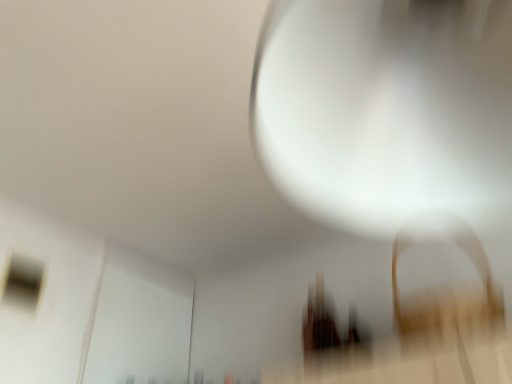
Question: From a real-world perspective, is matte glass window at upper left positioned under white glossy light bulb at upper center based on gravity?

Choices:
 (A) yes
 (B) no

Answer: (B)

Question: Is matte glass window at upper left located outside white glossy light bulb at upper center?

Choices:
 (A) no
 (B) yes

Answer: (B)

Question: Is matte glass window at upper left far away from white glossy light bulb at upper center?

Choices:
 (A) no
 (B) yes

Answer: (B)

Question: From a real-world perspective, is matte glass window at upper left over white glossy light bulb at upper center?

Choices:
 (A) no
 (B) yes

Answer: (B)

Question: Can you confirm if matte glass window at upper left is shorter than white glossy light bulb at upper center?

Choices:
 (A) no
 (B) yes

Answer: (B)

Question: Is matte glass window at upper left taller than white glossy light bulb at upper center?

Choices:
 (A) yes
 (B) no

Answer: (B)

Question: Could matte glass window at upper left be considered to be inside white glossy light bulb at upper center?

Choices:
 (A) yes
 (B) no

Answer: (B)

Question: From the image's perspective, is white glossy light bulb at upper center over matte glass window at upper left?

Choices:
 (A) no
 (B) yes

Answer: (B)

Question: From a real-world perspective, is white glossy light bulb at upper center below matte glass window at upper left?

Choices:
 (A) yes
 (B) no

Answer: (A)

Question: Considering the relative sizes of white glossy light bulb at upper center and matte glass window at upper left in the image provided, is white glossy light bulb at upper center shorter than matte glass window at upper left?

Choices:
 (A) no
 (B) yes

Answer: (A)

Question: Considering the relative sizes of white glossy light bulb at upper center and matte glass window at upper left in the image provided, is white glossy light bulb at upper center bigger than matte glass window at upper left?

Choices:
 (A) no
 (B) yes

Answer: (B)

Question: Are white glossy light bulb at upper center and matte glass window at upper left making contact?

Choices:
 (A) no
 (B) yes

Answer: (A)

Question: In terms of height, does matte glass window at upper left look taller or shorter compared to white glossy light bulb at upper center?

Choices:
 (A) short
 (B) tall

Answer: (A)